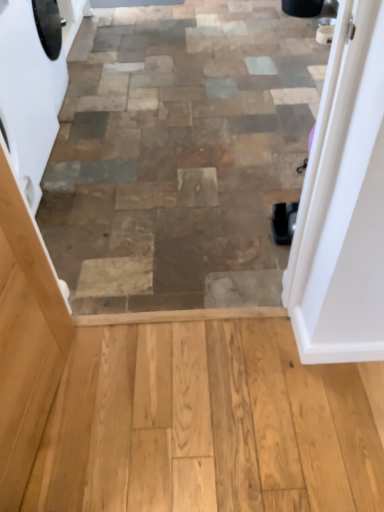
Question: Is white glossy door at upper right wider than light brown wood screen door at left?

Choices:
 (A) no
 (B) yes

Answer: (B)

Question: Is light brown wood screen door at left a part of white glossy door at upper right?

Choices:
 (A) yes
 (B) no

Answer: (B)

Question: Is white glossy door at upper right positioned far away from light brown wood screen door at left?

Choices:
 (A) yes
 (B) no

Answer: (B)

Question: Is white glossy door at upper right looking in the opposite direction of light brown wood screen door at left?

Choices:
 (A) no
 (B) yes

Answer: (A)

Question: Is white glossy door at upper right bigger than light brown wood screen door at left?

Choices:
 (A) no
 (B) yes

Answer: (A)

Question: Is white glossy door at upper right positioned beyond the bounds of light brown wood screen door at left?

Choices:
 (A) yes
 (B) no

Answer: (A)

Question: Does white glossy door at upper right turn towards white glossy washing machine at left?

Choices:
 (A) no
 (B) yes

Answer: (A)

Question: From a real-world perspective, is white glossy door at upper right physically above white glossy washing machine at left?

Choices:
 (A) no
 (B) yes

Answer: (B)

Question: From the image's perspective, is white glossy door at upper right located above white glossy washing machine at left?

Choices:
 (A) no
 (B) yes

Answer: (A)

Question: Does white glossy door at upper right have a smaller size compared to white glossy washing machine at left?

Choices:
 (A) yes
 (B) no

Answer: (A)

Question: From the image's perspective, is white glossy door at upper right beneath white glossy washing machine at left?

Choices:
 (A) yes
 (B) no

Answer: (A)

Question: Is white glossy door at upper right not within white glossy washing machine at left?

Choices:
 (A) yes
 (B) no

Answer: (A)

Question: Is white glossy door at upper right inside white glossy washing machine at left?

Choices:
 (A) no
 (B) yes

Answer: (A)